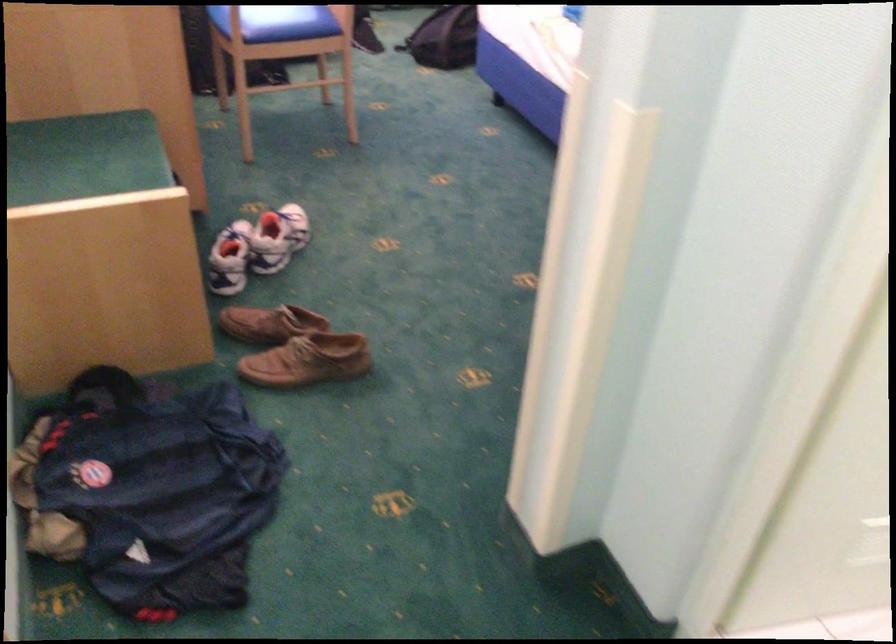
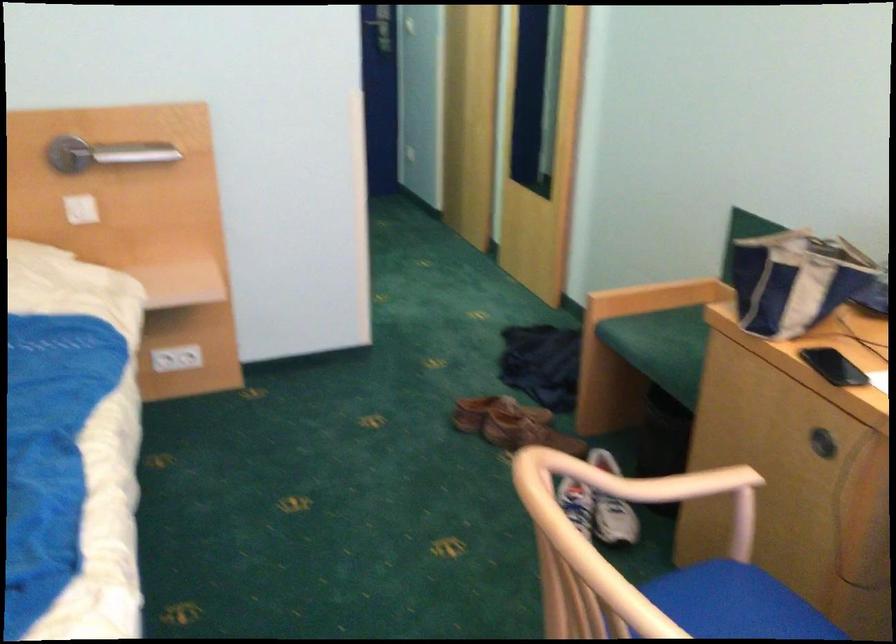
Find the pixel in the second image that matches point 149,158 in the first image.

(661, 346)